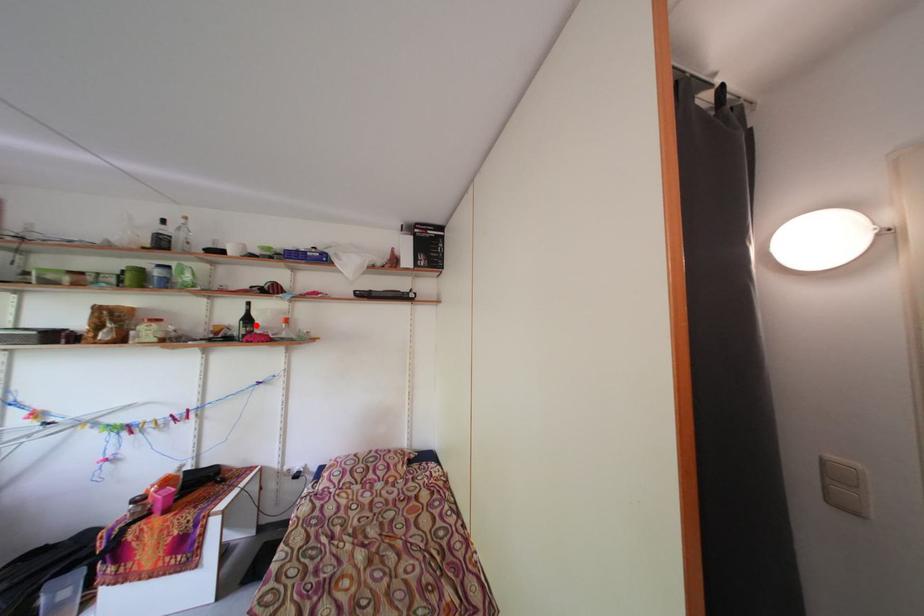
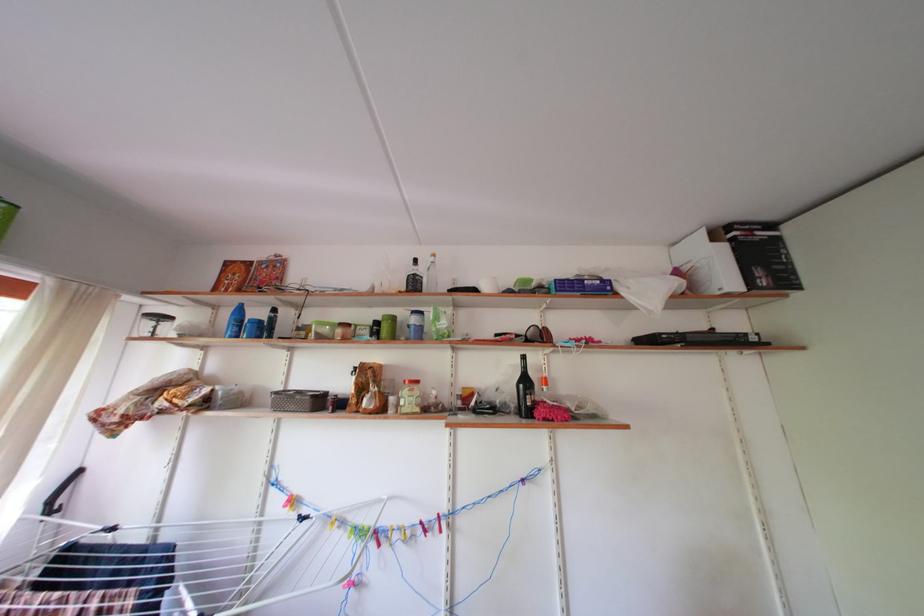
Find the pixel in the second image that matches the highlighted location in the first image.

(533, 387)